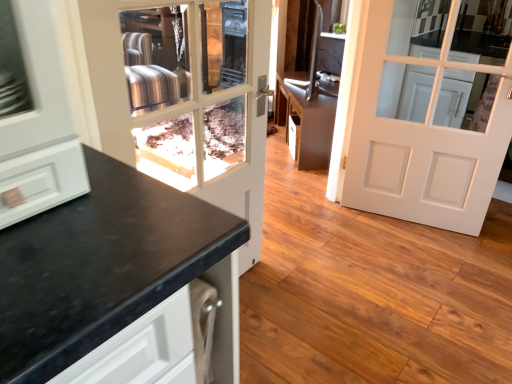
At what (x,y) coordinates should I click in order to perform the action: click on free location to the left of white matte door at center, placed as the first door when sorted from right to left. Please return your answer as a coordinate pair (x, y). Image resolution: width=512 pixels, height=384 pixels. Looking at the image, I should click on (350, 240).